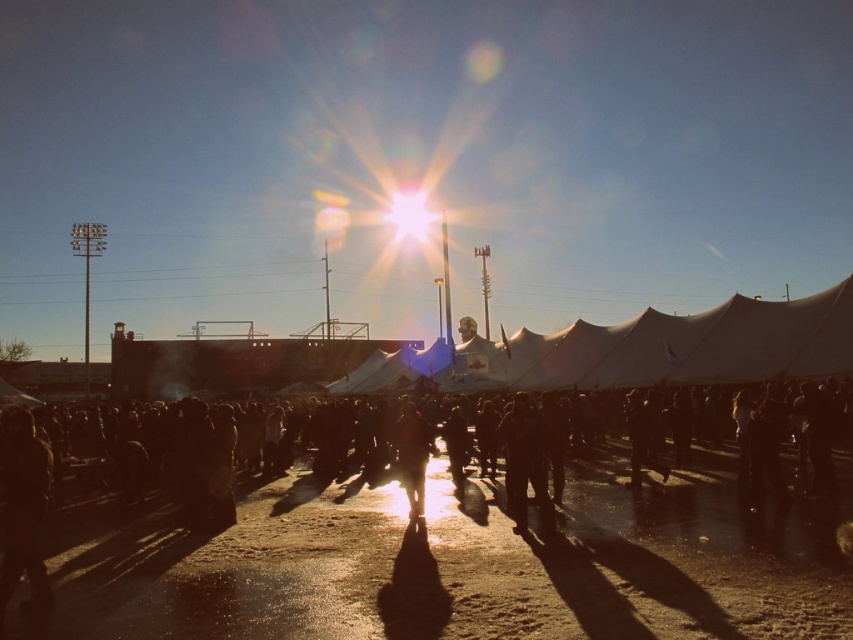
The image size is (853, 640). In order to click on dark fabric jacket at left in this screenshot , I will do [x=24, y=509].

Is point (502, 442) farther from camera compared to point (418, 502)?

Yes, point (502, 442) is farther from viewer.

Between point (505, 413) and point (427, 452), which one is positioned behind?

The point (505, 413) is behind.

This screenshot has height=640, width=853. I want to click on dark fabric pants at center, so click(521, 452).

Can you confirm if dark fabric jacket at left is bigger than dark fabric pants at center?

Indeed, dark fabric jacket at left has a larger size compared to dark fabric pants at center.

Is dark fabric jacket at left positioned in front of dark fabric pants at center?

Yes, dark fabric jacket at left is closer to the viewer.

You are a GUI agent. You are given a task and a screenshot of the screen. Output one action in this format:
    pyautogui.click(x=<x>, y=<y>)
    Task: Click on the dark fabric jacket at left
    Image resolution: width=853 pixels, height=640 pixels.
    Given the screenshot: What is the action you would take?
    pyautogui.click(x=24, y=509)

Identify the location of dark fabric jacket at left. The image size is (853, 640). [24, 509].